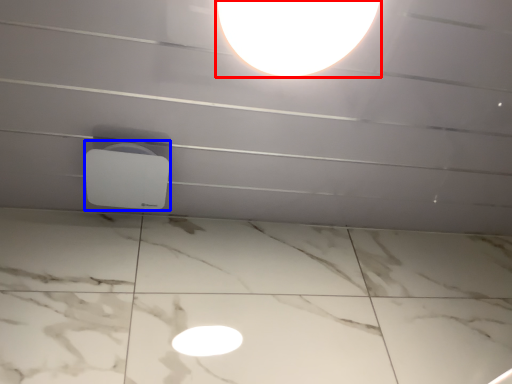
Question: Which object appears farthest to the camera in this image, lamp (highlighted by a red box) or lamp (highlighted by a blue box)?

Choices:
 (A) lamp
 (B) lamp

Answer: (B)